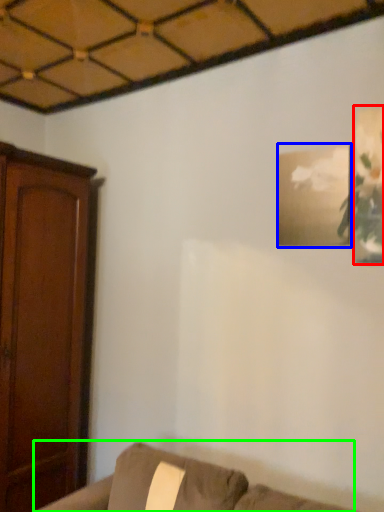
Question: Considering the real-world distances, which object is farthest from picture frame (highlighted by a red box)? picture frame (highlighted by a blue box) or furniture (highlighted by a green box)?

Choices:
 (A) picture frame
 (B) furniture

Answer: (B)